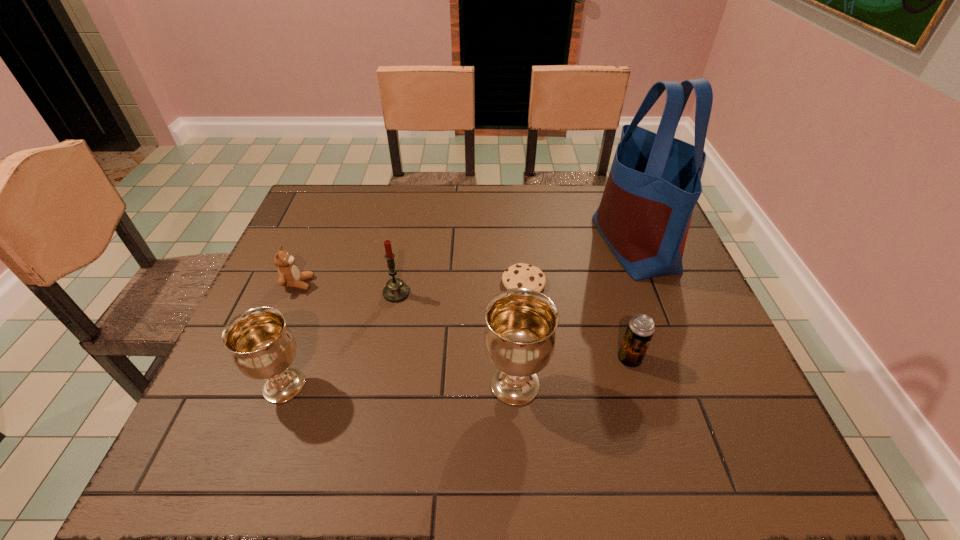
You are a GUI agent. You are given a task and a screenshot of the screen. Output one action in this format:
    pyautogui.click(x=<x>, y=<y>)
    Task: Click on the object that is at the far right corner
    
    Given the screenshot: What is the action you would take?
    pyautogui.click(x=654, y=183)

In the image, there is a desktop. Where is `vacant region at the far edge`? The width and height of the screenshot is (960, 540). vacant region at the far edge is located at coordinates (507, 211).

Where is `blank space at the left edge of the desktop`? The width and height of the screenshot is (960, 540). blank space at the left edge of the desktop is located at coordinates (317, 313).

This screenshot has height=540, width=960. Identify the location of free space at the right edge. (684, 288).

The image size is (960, 540). In the image, there is a desktop. Identify the location of free space at the far left corner. (304, 222).

Image resolution: width=960 pixels, height=540 pixels. I want to click on free point between the left chalice and the cookie, so click(404, 334).

What are the coordinates of `vacant area that lies between the beer can and the teddy bear` in the screenshot? It's located at (464, 321).

At what (x,y) coordinates should I click in order to perform the action: click on empty location between the candle and the shortest object. Please return your answer as a coordinate pair (x, y). Image resolution: width=960 pixels, height=540 pixels. Looking at the image, I should click on (460, 288).

Locate an element on the screen. This screenshot has width=960, height=540. vacant space that's between the teddy bear and the beer can is located at coordinates (464, 321).

This screenshot has height=540, width=960. Identify the location of unoccupied area between the handbag and the shorter chalice. (459, 314).